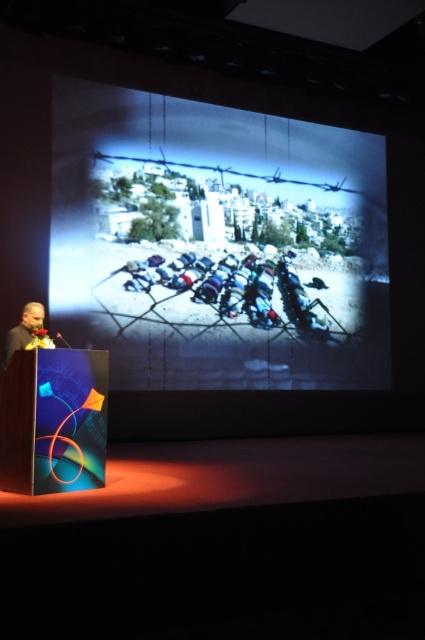
You are an event organizer setting up the presentation room. You notice the matte black screen at center and the black fabric at left. Which object is closer to the front of the stage?

The matte black screen at center is closer to the front of the stage because the black fabric at left is behind it.

You are a speaker at the podium. You notice two points on the projection screen. One is at coordinate point [193,124] and the other at coordinate point [22,330]. From your perspective at the podium, which point is closer to the front of the screen?

Point [22,330] is closer to the front of the screen because it is in front of point [193,124].

In the scene shown: You are setting up for a presentation and need to place a large poster. The poster is 2 meters wide. You have two options on the wall where to place it. One is the matte black screen at center and the other is the black fabric at left. Based on their sizes, which one can accommodate the poster?

The matte black screen at center has a larger size compared to the black fabric at left, so the poster can be placed on the matte black screen at center if it is at least 2 meters wide.